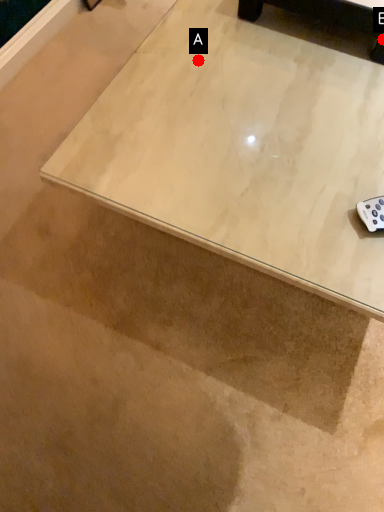
Question: Two points are circled on the image, labeled by A and B beside each circle. Which of the following is the farthest from the observer?

Choices:
 (A) A is further
 (B) B is further

Answer: (B)